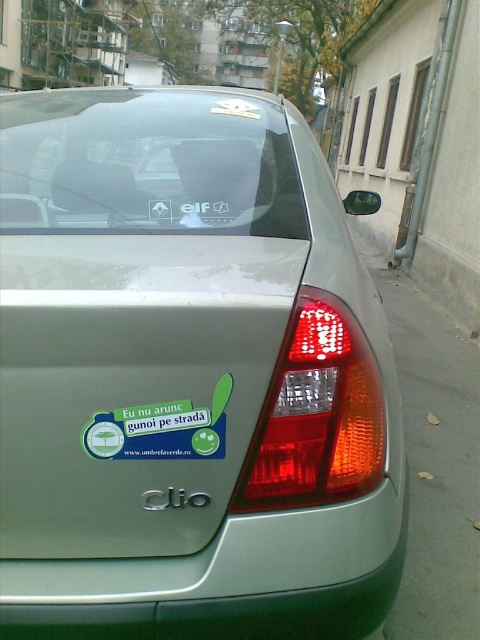
You are a pedestrian standing on the sidewalk next to the satin silver car at center. You want to take a photo of the green sticker at center on the car. Since the car is much bigger than the sticker, how should you position yourself to ensure the sticker is clearly visible in the photo?

Since the satin silver car at center is larger than the green sticker at center, you should position yourself closer to the car to focus on the green sticker at center, ensuring it isn not obscured by the car itself.